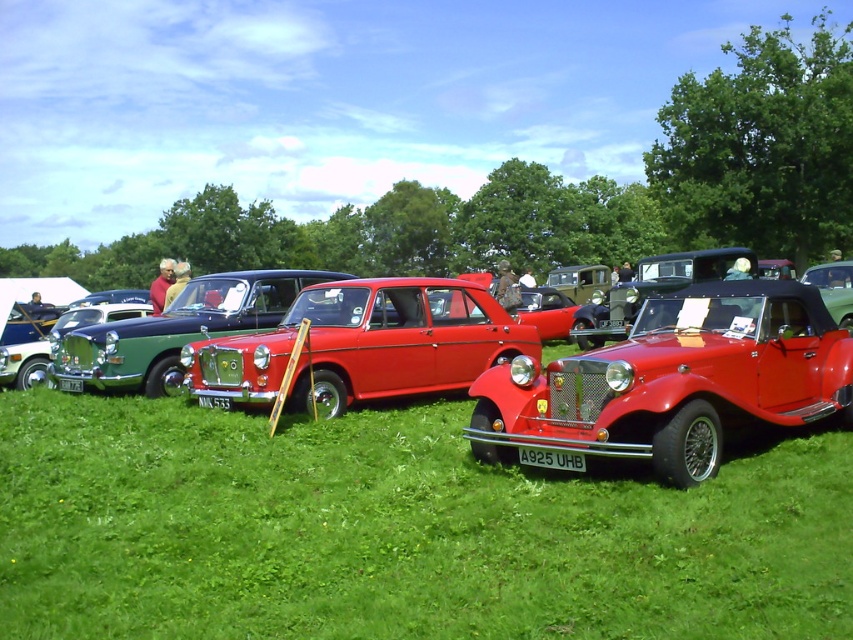
Does shiny red car at center appear on the left side of shiny metallic sedan at center?

In fact, shiny red car at center is to the right of shiny metallic sedan at center.

Find the location of a particular element. The image size is (853, 640). shiny red car at center is located at coordinates (x=671, y=381).

This screenshot has height=640, width=853. What are the coordinates of `shiny red car at center` in the screenshot? It's located at (671, 381).

From the picture: Who is positioned more to the right, shiny red convertible at center or glossy red sedan at center?

From the viewer's perspective, shiny red convertible at center appears more on the right side.

How far apart are shiny red convertible at center and glossy red sedan at center?

The distance of shiny red convertible at center from glossy red sedan at center is 11.34 feet.

Is point (474, 452) positioned before point (207, 378)?

Yes, point (474, 452) is closer to viewer.

Identify the location of shiny red convertible at center. (671, 381).

This screenshot has width=853, height=640. Describe the element at coordinates (395, 531) in the screenshot. I see `green grass at lower center` at that location.

Where is `green grass at lower center`? green grass at lower center is located at coordinates (395, 531).

Which is in front, point (759, 570) or point (426, 328)?

Point (759, 570) is more forward.

Find the location of a particular element. The height and width of the screenshot is (640, 853). green grass at lower center is located at coordinates (395, 531).